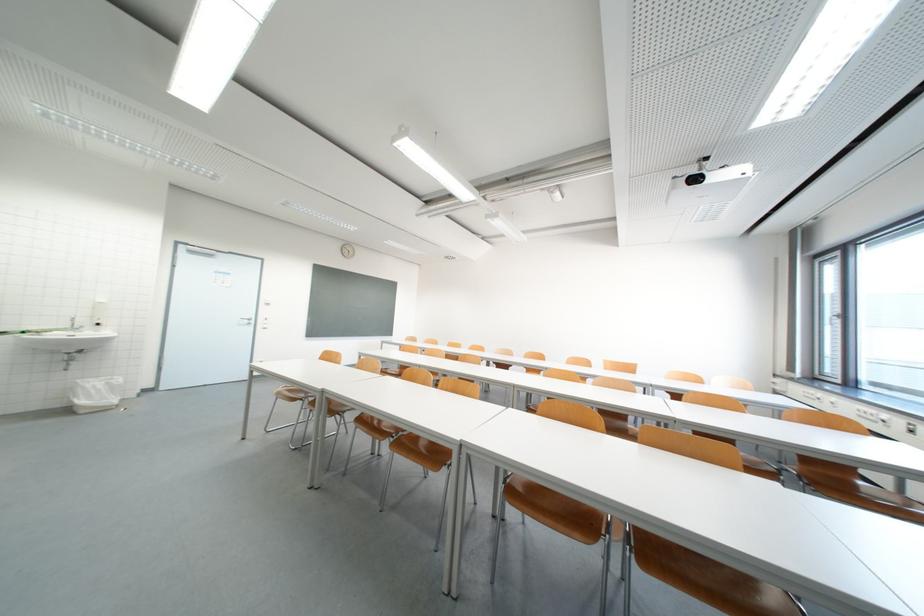
Which object does [94,394] point to?

This point indicates the white trash can.